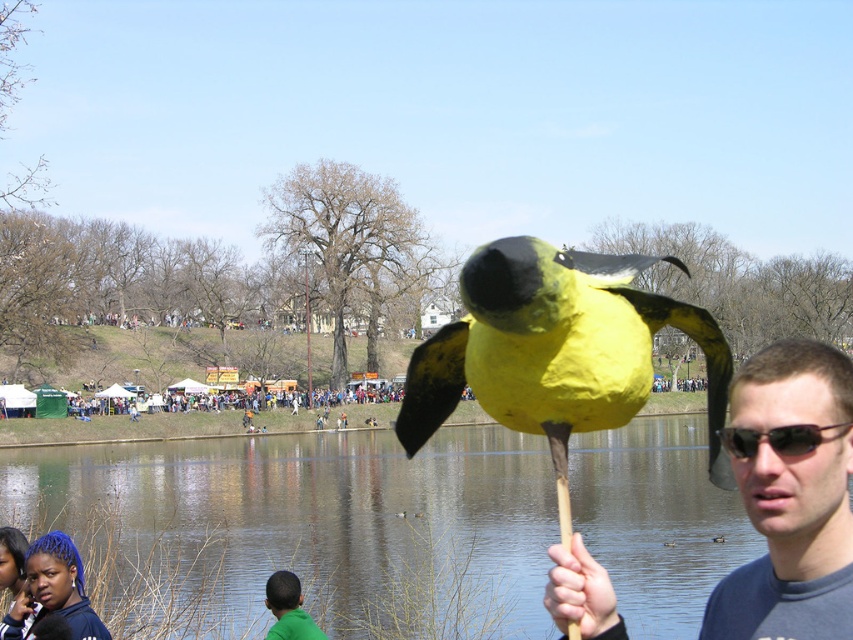
You are observing a person in the scene. The person is wearing a green matte shirt at lower center and has sunglassestransparent at right. Which item is positioned higher relative to the other?

The sunglassestransparent at right is above the green matte shirt at lower center, so the sunglasses are positioned higher than the shirt.